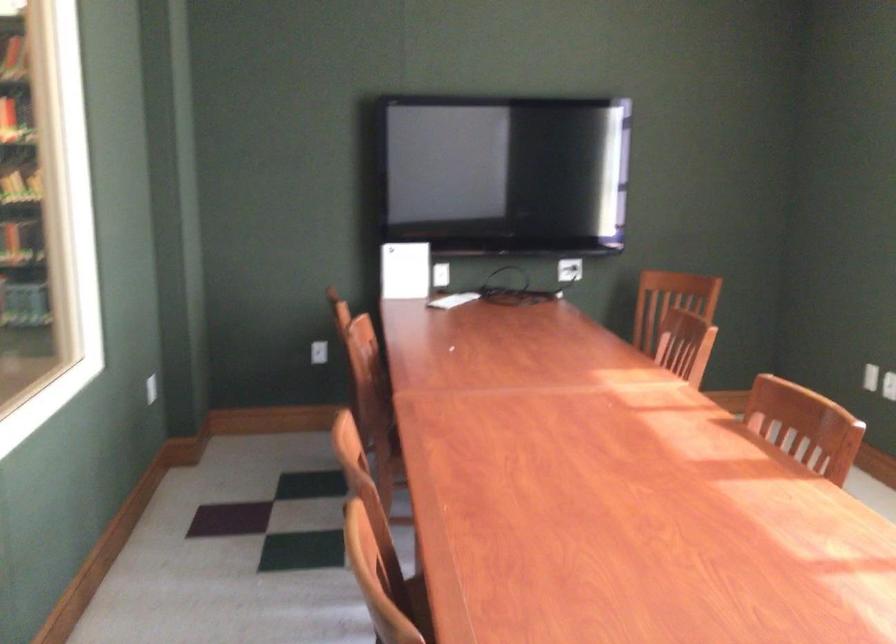
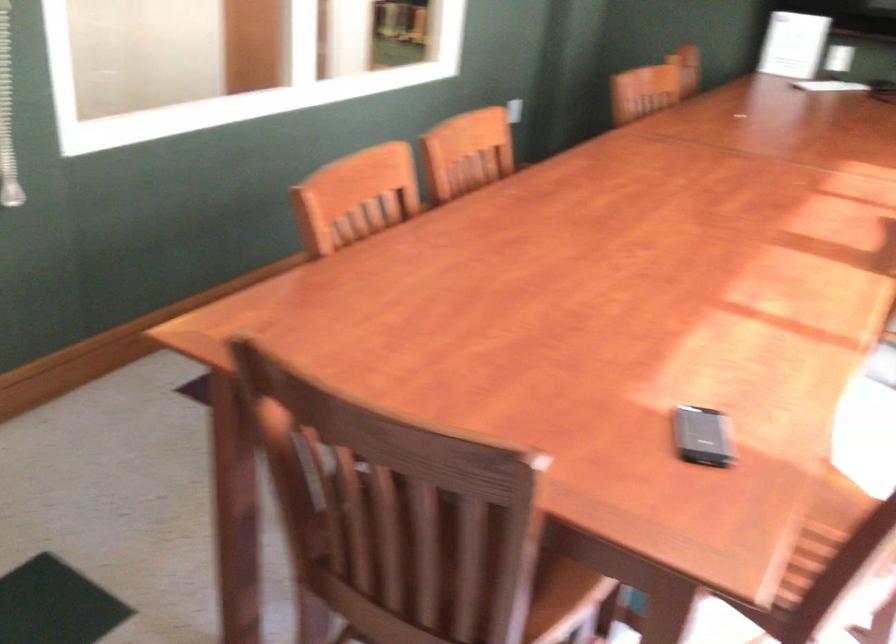
How did the camera likely rotate?

The camera rotated toward left-down.